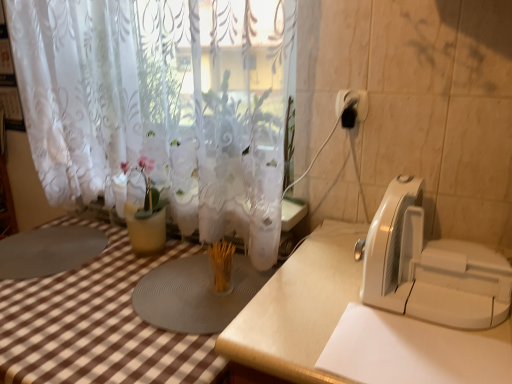
The width and height of the screenshot is (512, 384). What are the coordinates of `vacant area in front of white plastic appliance at right` in the screenshot? It's located at (428, 352).